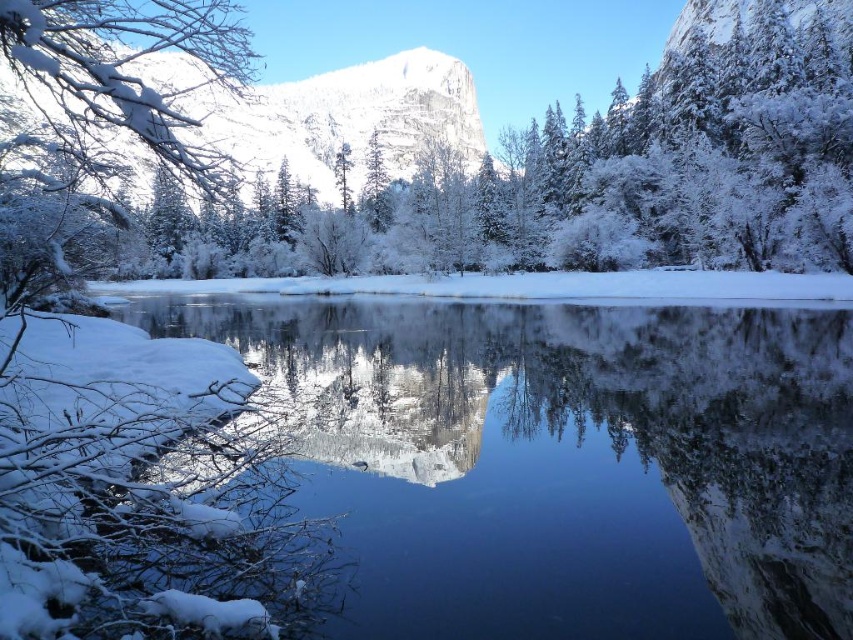
Which is more to the left, clear glass water at center or green matte tree at center?

From the viewer's perspective, green matte tree at center appears more on the left side.

Does clear glass water at center lie behind green matte tree at center?

No, it is not.

Is point (422, 429) positioned behind point (347, 209)?

No, (422, 429) is closer to viewer.

Where is `clear glass water at center`? Image resolution: width=853 pixels, height=640 pixels. clear glass water at center is located at coordinates (566, 461).

Which of these two, white snow-covered mountain at center or green matte tree at center, stands taller?

With more height is white snow-covered mountain at center.

Does white snow-covered mountain at center have a greater width compared to green matte tree at center?

Yes, white snow-covered mountain at center is wider than green matte tree at center.

Does point (463, 97) lie in front of point (341, 204)?

No, (463, 97) is behind (341, 204).

Identify the location of white snow-covered mountain at center. (346, 118).

Is white snow-covered branch at left further to camera compared to green matte tree at center?

No.

Can you confirm if white snow-covered branch at left is positioned above green matte tree at center?

Correct, white snow-covered branch at left is located above green matte tree at center.

Is point (85, 168) behind point (340, 161)?

No, (85, 168) is in front of (340, 161).

Where is `white snow-covered branch at left`? Image resolution: width=853 pixels, height=640 pixels. white snow-covered branch at left is located at coordinates (99, 120).